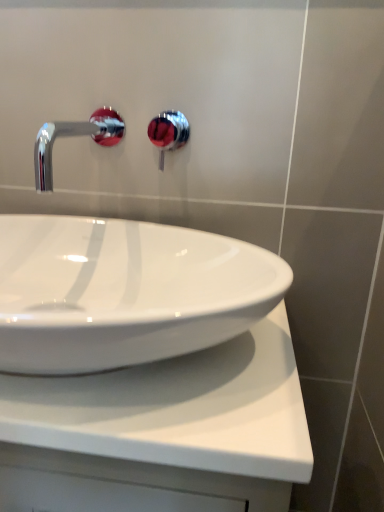
Question: From a real-world perspective, is chrome/red faucet at upper center below white glossy countertop at center?

Choices:
 (A) yes
 (B) no

Answer: (B)

Question: Does chrome/red faucet at upper center have a greater width compared to white glossy countertop at center?

Choices:
 (A) no
 (B) yes

Answer: (A)

Question: Is the depth of chrome/red faucet at upper center less than that of white glossy countertop at center?

Choices:
 (A) yes
 (B) no

Answer: (B)

Question: Would you say chrome/red faucet at upper center is a long distance from white glossy countertop at center?

Choices:
 (A) no
 (B) yes

Answer: (A)

Question: Considering the relative positions of chrome/red faucet at upper center and white glossy countertop at center in the image provided, is chrome/red faucet at upper center to the right of white glossy countertop at center from the viewer's perspective?

Choices:
 (A) yes
 (B) no

Answer: (A)

Question: From a real-world perspective, is chrome/metallic faucet at upper left physically located above or below white glossy countertop at center?

Choices:
 (A) below
 (B) above

Answer: (B)

Question: Is chrome/metallic faucet at upper left inside the boundaries of white glossy countertop at center, or outside?

Choices:
 (A) inside
 (B) outside

Answer: (B)

Question: In the image, is chrome/metallic faucet at upper left positioned in front of or behind white glossy countertop at center?

Choices:
 (A) front
 (B) behind

Answer: (B)

Question: From the image's perspective, is chrome/metallic faucet at upper left positioned above or below white glossy countertop at center?

Choices:
 (A) above
 (B) below

Answer: (A)

Question: From the image's perspective, is white glossy countertop at center located above or below chrome/red faucet at upper center?

Choices:
 (A) above
 (B) below

Answer: (B)

Question: From their relative heights in the image, would you say white glossy countertop at center is taller or shorter than chrome/red faucet at upper center?

Choices:
 (A) tall
 (B) short

Answer: (A)

Question: Considering the relative positions of white glossy countertop at center and chrome/red faucet at upper center in the image provided, is white glossy countertop at center to the left or to the right of chrome/red faucet at upper center?

Choices:
 (A) right
 (B) left

Answer: (B)

Question: Is white glossy countertop at center inside or outside of chrome/red faucet at upper center?

Choices:
 (A) outside
 (B) inside

Answer: (A)

Question: In terms of size, does chrome/metallic faucet at upper left appear bigger or smaller than chrome/red faucet at upper center?

Choices:
 (A) small
 (B) big

Answer: (B)

Question: Is chrome/metallic faucet at upper left wider or thinner than chrome/red faucet at upper center?

Choices:
 (A) wide
 (B) thin

Answer: (A)